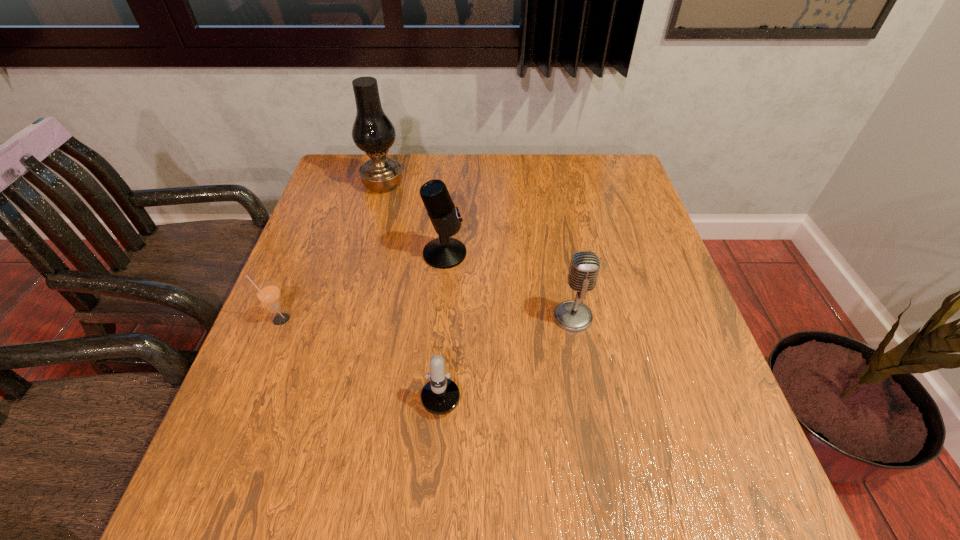
Find the location of a particular element. This screenshot has width=960, height=540. vacant point that satisfies the following two spatial constraints: 1. on the front side of the farthest object; 2. on the right side of the nearest microphone is located at coordinates (331, 377).